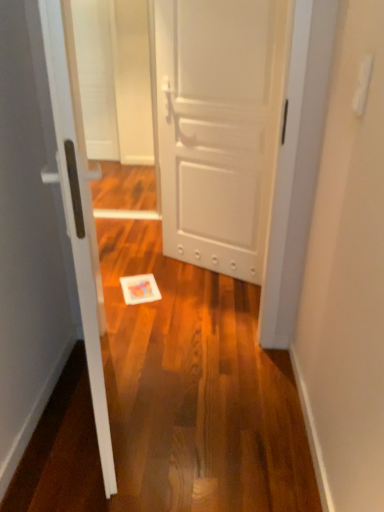
Where is `free region on the left part of white matte door at center, which appears as the second door when viewed from the front`? The width and height of the screenshot is (384, 512). free region on the left part of white matte door at center, which appears as the second door when viewed from the front is located at coordinates (151, 269).